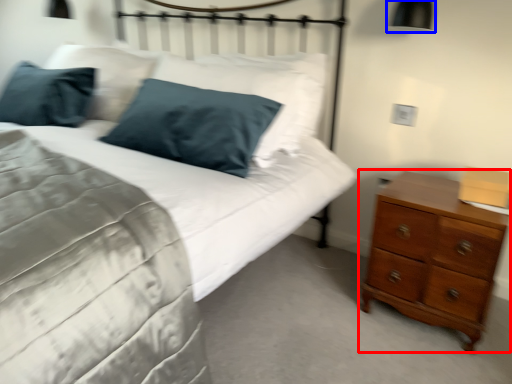
Question: Which point is further to the camera, chest of drawers (highlighted by a red box) or bedside lamp (highlighted by a blue box)?

Choices:
 (A) chest of drawers
 (B) bedside lamp

Answer: (B)